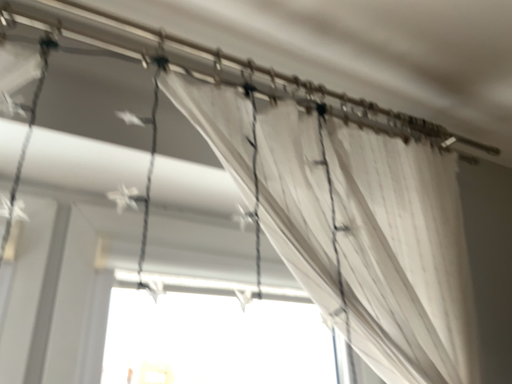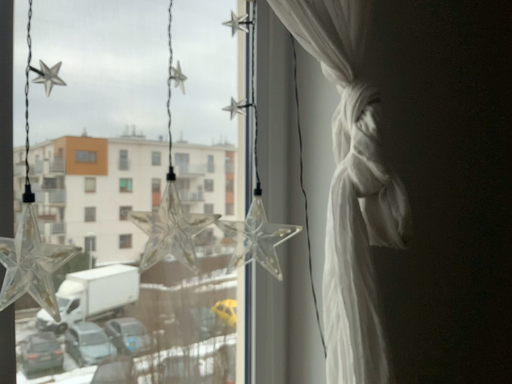
Question: Which way did the camera rotate in the video?

Choices:
 (A) rotated left
 (B) rotated right

Answer: (B)